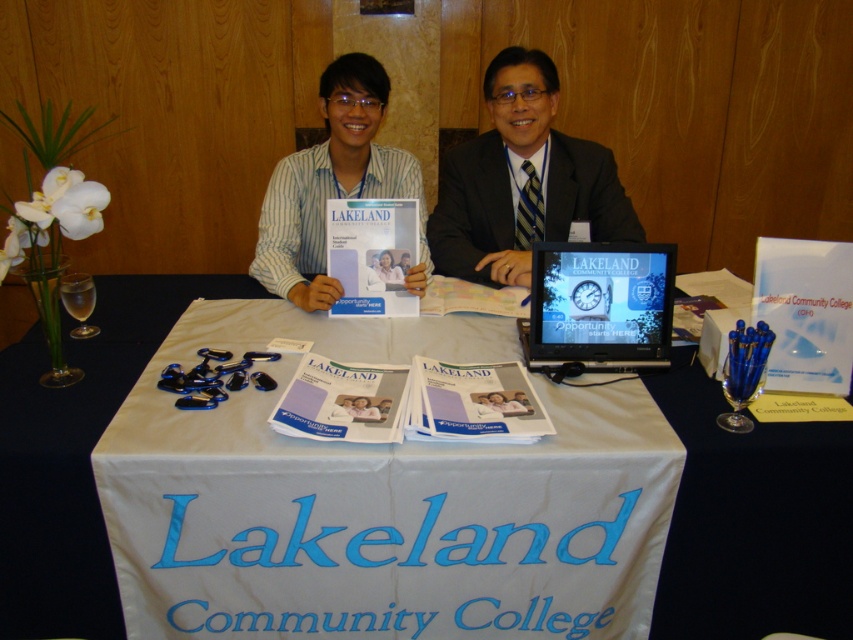
You are planning to place a small decorative item on the table at Lakeland Community College booth. The item requires a space that is wider than the white fabric at center. Can you place it on the matte white paper at center?

The white fabric at center is taller than matte white paper at center. Therefore, the matte white paper at center is shorter and might not provide enough width for the item requiring a space wider than the white fabric. It is advisable to choose another location.

Based on the scene described, what is located at the coordinates point (379, 500)?

The point (379, 500) marks the location of the white fabric at center.

You are standing in front of the Lakeland Community College table at an event. There are two points marked on the table surface. The first point is at coordinate location [352,570] and the second point is at [641,300]. If you want to place a new brochure closer to your current position, which point should you choose?

You should choose point [352,570] because it is closer to the camera, which is your current position, than point [641,300].